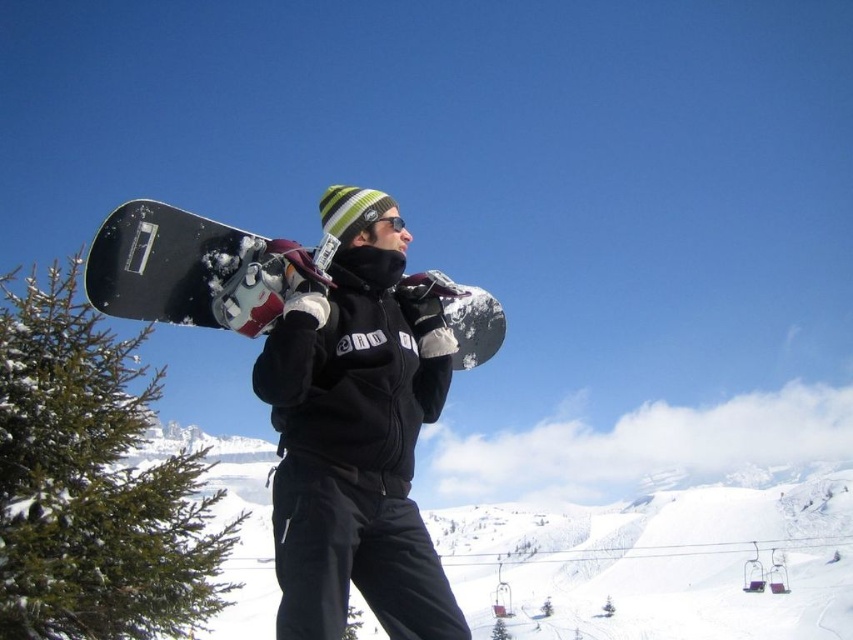
You are a drone operator trying to capture a photo of the white fluffy snow at center. The camera is currently positioned at point 0.5, 0.5. What direction should you move the camera to get a better shot?

The white fluffy snow at center is located at point (660,560), so you should move the camera to the right and downward to capture it better.

You are planning to take a photo of the green matte pine at left and the black matte snowboard at upper center. Which object should you focus on first if you want to capture both in the same frame without moving the camera?

The green matte pine at left is taller than the black matte snowboard at upper center, so you should focus on the green matte pine at left first to ensure it fits within the frame.